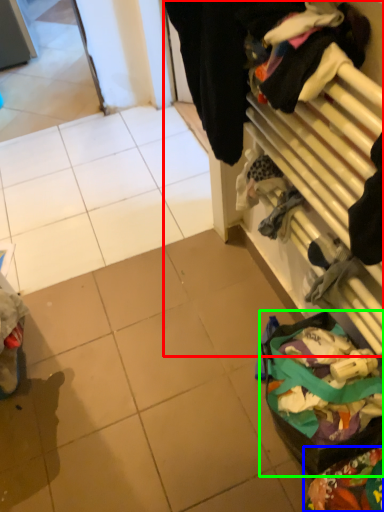
Question: Based on their relative distances, which object is nearer to closet (highlighted by a red box)? Choose from waste (highlighted by a blue box) and waste (highlighted by a green box).

Choices:
 (A) waste
 (B) waste

Answer: (B)